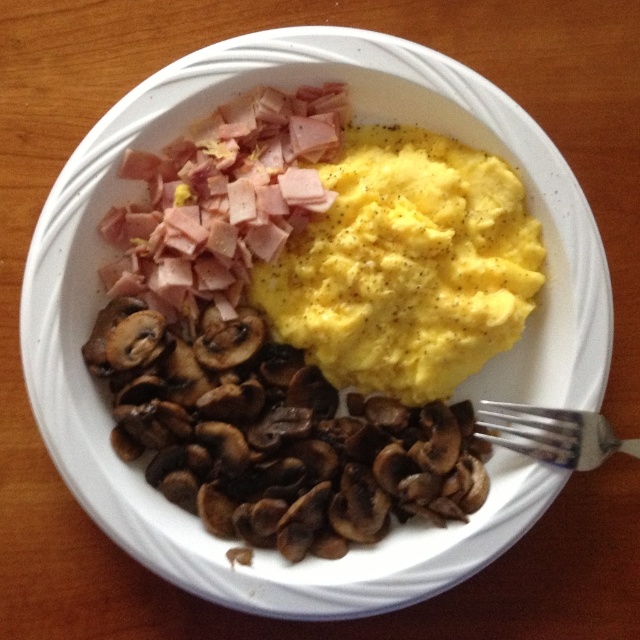
You are a food critic analyzing the placement of ingredients on a plate. The plate has scrambled eggs at top right, ham at top left, and mushrooms at bottom center. A specific point on the plate is marked at coordinates point [406,266]. Which ingredient is this point located on?

The point [406,266] is on the yellow matte egg at center.

You are a person sitting at the table and want to pick up the silver metallic fork at lower right. Can you easily reach it without moving the brown glossy mushrooms at left?

The silver metallic fork at lower right is behind brown glossy mushrooms at left, so you can easily reach it without moving the mushrooms because it is positioned behind them and not obstructed.